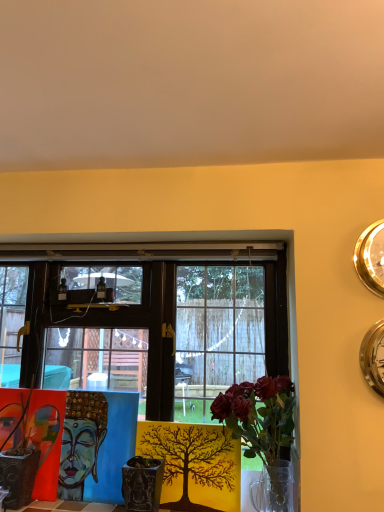
Question: From the image's perspective, is gold metallic clock at upper right, placed as the first clock when sorted from top to bottom, located above silver metallic clock at upper right, the second clock positioned from the top?

Choices:
 (A) yes
 (B) no

Answer: (A)

Question: Considering the relative sizes of gold metallic clock at upper right, placed as the first clock when sorted from top to bottom, and silver metallic clock at upper right, the second clock positioned from the top, in the image provided, is gold metallic clock at upper right, placed as the first clock when sorted from top to bottom, wider than silver metallic clock at upper right, the second clock positioned from the top,?

Choices:
 (A) yes
 (B) no

Answer: (A)

Question: Is gold metallic clock at upper right, which is the second clock in bottom-to-top order, not near silver metallic clock at upper right, the second clock positioned from the top?

Choices:
 (A) yes
 (B) no

Answer: (B)

Question: Is gold metallic clock at upper right, which is the second clock in bottom-to-top order, at the left side of silver metallic clock at upper right, the second clock positioned from the top?

Choices:
 (A) yes
 (B) no

Answer: (A)

Question: Considering the relative sizes of gold metallic clock at upper right, which is the second clock in bottom-to-top order, and silver metallic clock at upper right, which is the first clock in bottom-to-top order, in the image provided, is gold metallic clock at upper right, which is the second clock in bottom-to-top order, bigger than silver metallic clock at upper right, which is the first clock in bottom-to-top order,?

Choices:
 (A) yes
 (B) no

Answer: (B)

Question: From a real-world perspective, is wooden table at center above or below textured ceramic pot at center?

Choices:
 (A) above
 (B) below

Answer: (A)

Question: From the image's perspective, is wooden table at center above or below textured ceramic pot at center?

Choices:
 (A) above
 (B) below

Answer: (A)

Question: Is wooden table at center bigger or smaller than textured ceramic pot at center?

Choices:
 (A) small
 (B) big

Answer: (B)

Question: From their relative heights in the image, would you say wooden table at center is taller or shorter than textured ceramic pot at center?

Choices:
 (A) tall
 (B) short

Answer: (A)

Question: From the image's perspective, is silver metallic clock at upper right, which is the first clock in bottom-to-top order, positioned above or below wooden table at center?

Choices:
 (A) below
 (B) above

Answer: (B)

Question: From a real-world perspective, is silver metallic clock at upper right, the second clock positioned from the top, physically located above or below wooden table at center?

Choices:
 (A) below
 (B) above

Answer: (B)

Question: In terms of size, does silver metallic clock at upper right, which is the first clock in bottom-to-top order, appear bigger or smaller than wooden table at center?

Choices:
 (A) small
 (B) big

Answer: (A)

Question: In the image, is silver metallic clock at upper right, the second clock positioned from the top, positioned in front of or behind wooden table at center?

Choices:
 (A) front
 (B) behind

Answer: (A)

Question: Based on their sizes in the image, would you say gold metallic clock at upper right, which is the second clock in bottom-to-top order, is bigger or smaller than wooden table at center?

Choices:
 (A) small
 (B) big

Answer: (A)

Question: Considering the relative positions of gold metallic clock at upper right, which is the second clock in bottom-to-top order, and wooden table at center in the image provided, is gold metallic clock at upper right, which is the second clock in bottom-to-top order, to the left or to the right of wooden table at center?

Choices:
 (A) right
 (B) left

Answer: (A)